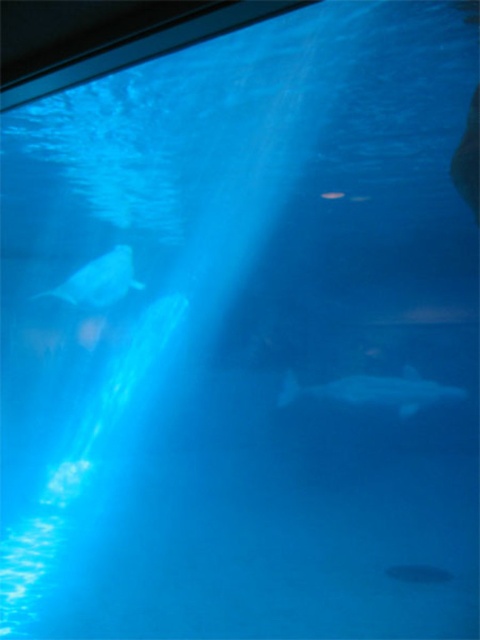
You are a marine biologist observing the underwater scene through the glass barrier. You notice the translucent white shark at lower center and the white matte whale at upper left. Which of these two marine animals appears larger in size?

The translucent white shark at lower center appears larger in size than the white matte whale at upper left.

Looking at this image, you are an underwater explorer looking at the aquarium scene. You notice two points marked in the image. The first point is at coordinates point (x=388, y=380) and the second is at point (x=93, y=301). From your vantage point, which point is closer to you?

Point (x=93, y=301) is closer to you because point (x=388, y=380) is behind it.